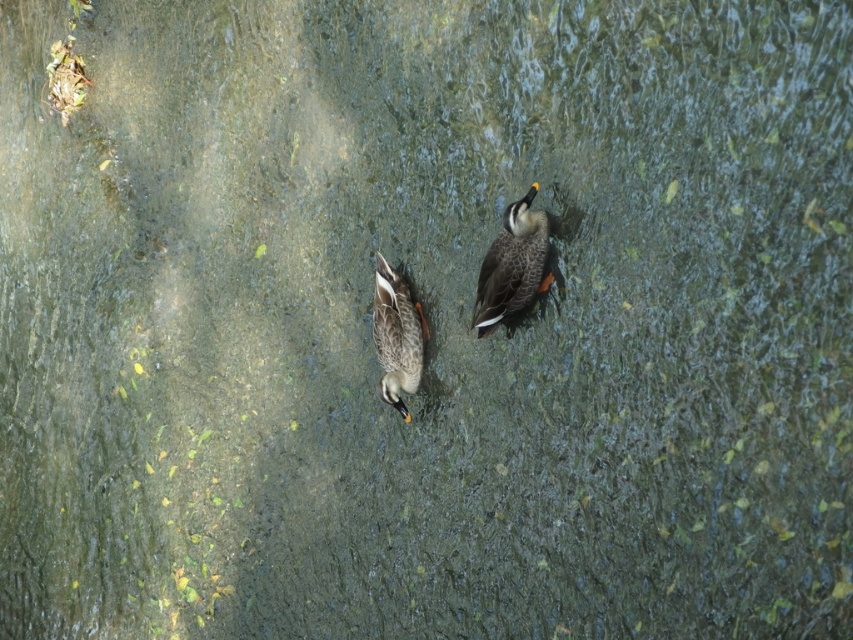
Which is more to the right, speckled brown duck at upper right or speckled brown duck at center?

Positioned to the right is speckled brown duck at upper right.

Which is in front, point (514, 250) or point (386, 339)?

Point (514, 250) is in front.

In the scene shown: Who is more forward, (503, 220) or (409, 312)?

Point (503, 220) is in front.

Find the location of a particular element. speckled brown duck at upper right is located at coordinates (512, 264).